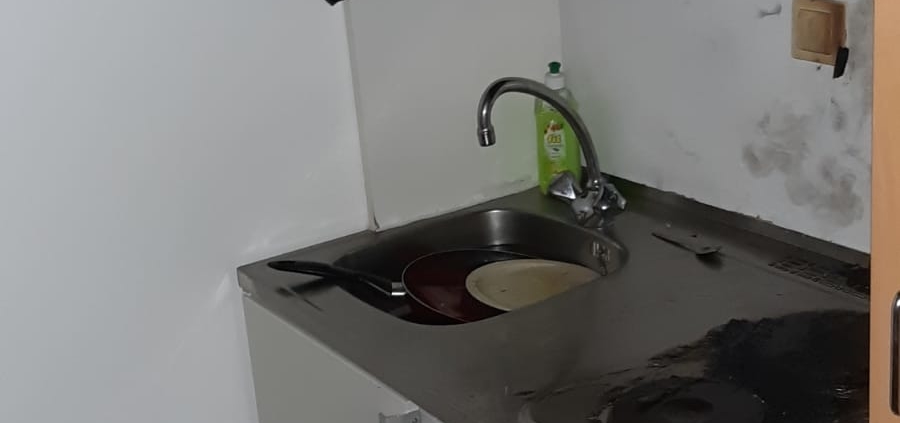
The image size is (900, 423). Identify the location of spoon. (694, 243).